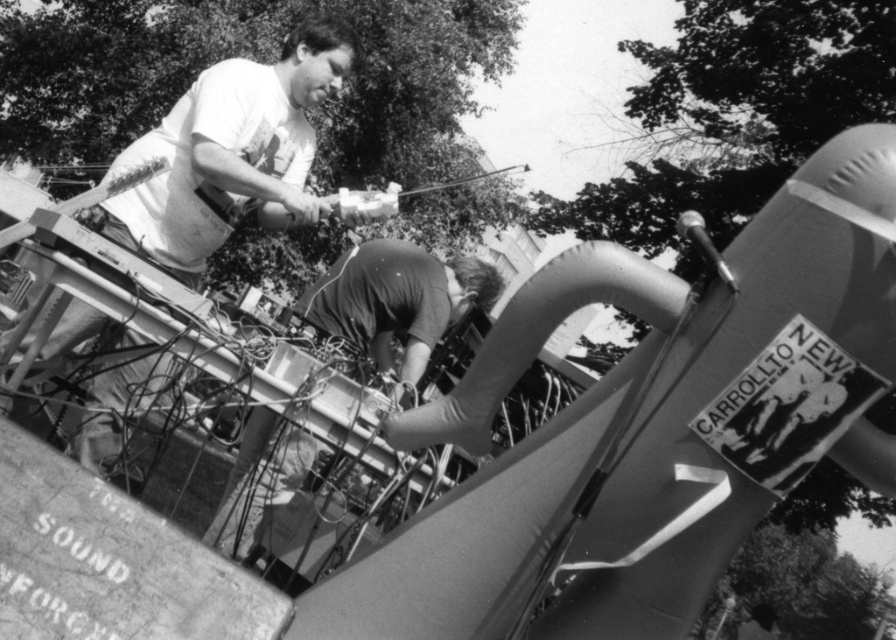
Question: Among these points, which one is nearest to the camera?

Choices:
 (A) (204, 218)
 (B) (479, 294)

Answer: (A)

Question: Does white t-shirt at upper left lie behind smooth dark fabric skateboard at center?

Choices:
 (A) no
 (B) yes

Answer: (A)

Question: Which point is farther from the camera taking this photo?

Choices:
 (A) (418, 305)
 (B) (329, 54)

Answer: (A)

Question: Is white t-shirt at upper left closer to the viewer compared to smooth dark fabric skateboard at center?

Choices:
 (A) yes
 (B) no

Answer: (A)

Question: Does white t-shirt at upper left have a smaller size compared to smooth dark fabric skateboard at center?

Choices:
 (A) yes
 (B) no

Answer: (B)